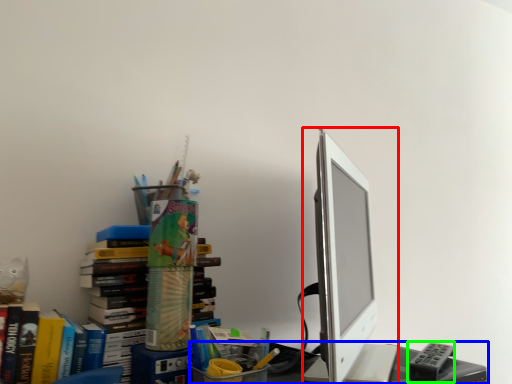
Question: Which is nearer to the computer monitor (highlighted by a red box)? desk (highlighted by a blue box) or stationery (highlighted by a green box).

Choices:
 (A) desk
 (B) stationery

Answer: (A)